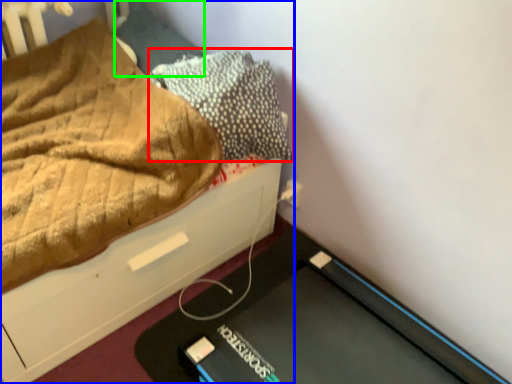
Question: Based on their relative distances, which object is nearer to pillow (highlighted by a red box)? Choose from bed (highlighted by a blue box) and pillow (highlighted by a green box).

Choices:
 (A) bed
 (B) pillow

Answer: (A)